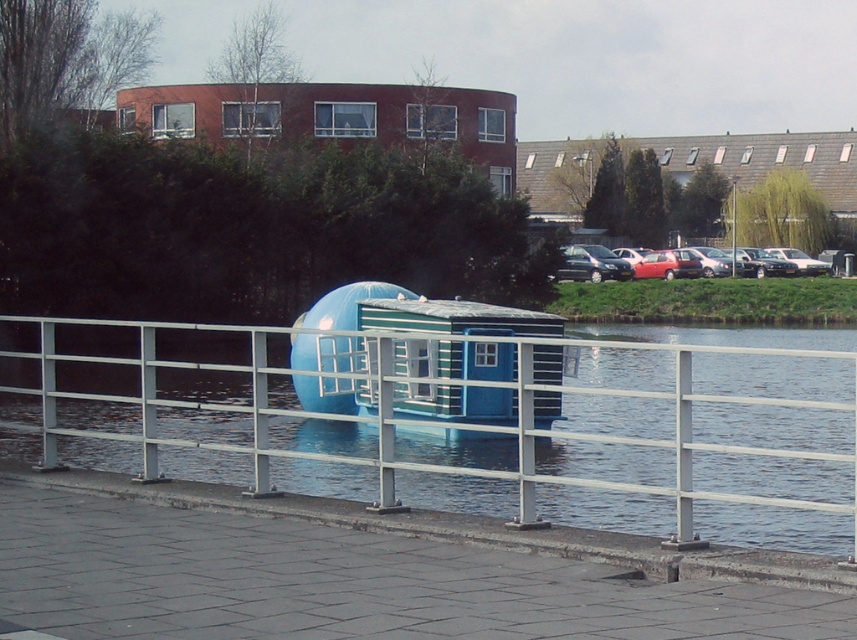
Question: Which of the following is the closest to the observer?

Choices:
 (A) gray concrete dock at lower center
 (B) metallic silver fence at center

Answer: (B)

Question: Which point is closer to the camera?

Choices:
 (A) metallic silver fence at center
 (B) gray concrete dock at lower center

Answer: (A)

Question: Can you confirm if gray concrete dock at lower center is smaller than metallic silver fence at center?

Choices:
 (A) yes
 (B) no

Answer: (A)

Question: Is gray concrete dock at lower center wider than metallic silver fence at center?

Choices:
 (A) yes
 (B) no

Answer: (B)

Question: Which point is farther from the camera taking this photo?

Choices:
 (A) (691, 604)
 (B) (706, 376)

Answer: (B)

Question: Is gray concrete dock at lower center thinner than metallic silver fence at center?

Choices:
 (A) yes
 (B) no

Answer: (A)